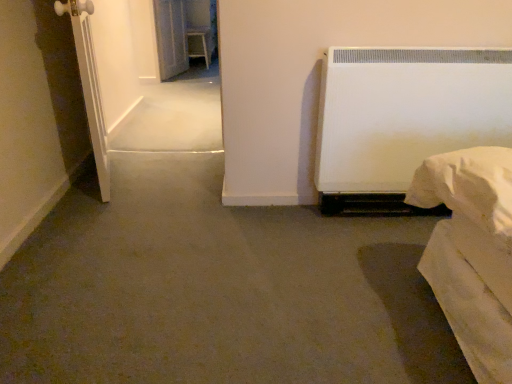
Question: In terms of height, does transparent glass screen door at upper left, which appears as the second screen door when ordered from the bottom, look taller or shorter compared to white matte screen door at left, placed as the first screen door when sorted from bottom to top?

Choices:
 (A) tall
 (B) short

Answer: (B)

Question: Choose the correct answer: Is transparent glass screen door at upper left, the first screen door positioned from the top, inside white matte screen door at left, which appears as the second screen door when viewed from the back, or outside it?

Choices:
 (A) inside
 (B) outside

Answer: (B)

Question: From the image's perspective, is transparent glass screen door at upper left, which is the 1th screen door from back to front, above or below white matte screen door at left, placed as the first screen door when sorted from bottom to top?

Choices:
 (A) above
 (B) below

Answer: (A)

Question: Looking at their shapes, would you say white matte screen door at left, which appears as the second screen door when viewed from the back, is wider or thinner than transparent glass screen door at upper left, positioned as the second screen door in front-to-back order?

Choices:
 (A) wide
 (B) thin

Answer: (A)

Question: Is point (81, 16) positioned closer to the camera than point (179, 1)?

Choices:
 (A) farther
 (B) closer

Answer: (B)

Question: Is white matte screen door at left, placed as the first screen door when sorted from front to back, taller or shorter than transparent glass screen door at upper left, which is the 1th screen door from back to front?

Choices:
 (A) tall
 (B) short

Answer: (A)

Question: Choose the correct answer: Is white matte screen door at left, the second screen door when ordered from top to bottom, inside transparent glass screen door at upper left, which is the 1th screen door from back to front, or outside it?

Choices:
 (A) outside
 (B) inside

Answer: (A)